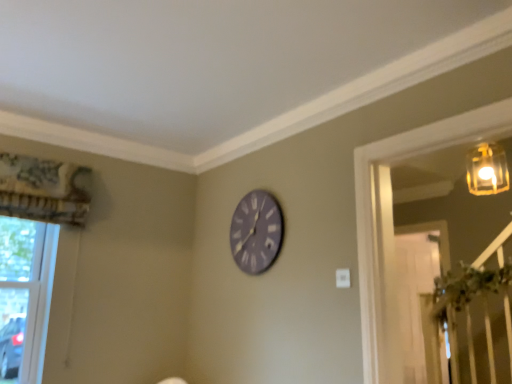
Question: Is the depth of clear glass window at lower left greater than that of matte gray clock at center?

Choices:
 (A) yes
 (B) no

Answer: (B)

Question: From a real-world perspective, does clear glass window at lower left stand above matte gray clock at center?

Choices:
 (A) yes
 (B) no

Answer: (B)

Question: From a real-world perspective, is clear glass window at lower left below matte gray clock at center?

Choices:
 (A) yes
 (B) no

Answer: (A)

Question: Is clear glass window at lower left facing away from matte gray clock at center?

Choices:
 (A) yes
 (B) no

Answer: (B)

Question: From the image's perspective, does clear glass window at lower left appear higher than matte gray clock at center?

Choices:
 (A) yes
 (B) no

Answer: (B)

Question: Is clear glass window at lower left positioned in front of matte gray clock at center?

Choices:
 (A) yes
 (B) no

Answer: (A)

Question: Does matte gray clock at center have a lesser width compared to clear glass window at lower left?

Choices:
 (A) no
 (B) yes

Answer: (B)

Question: Would you say matte gray clock at center is a long distance from clear glass window at lower left?

Choices:
 (A) no
 (B) yes

Answer: (B)

Question: From the image's perspective, is matte gray clock at center below clear glass window at lower left?

Choices:
 (A) no
 (B) yes

Answer: (A)

Question: Does matte gray clock at center have a smaller size compared to clear glass window at lower left?

Choices:
 (A) yes
 (B) no

Answer: (A)

Question: Can you confirm if matte gray clock at center is positioned to the right of clear glass window at lower left?

Choices:
 (A) yes
 (B) no

Answer: (A)

Question: Is matte gray clock at center facing away from clear glass window at lower left?

Choices:
 (A) no
 (B) yes

Answer: (A)

Question: Looking at their shapes, would you say clear glass window at lower left is wider or thinner than matte gray clock at center?

Choices:
 (A) wide
 (B) thin

Answer: (A)